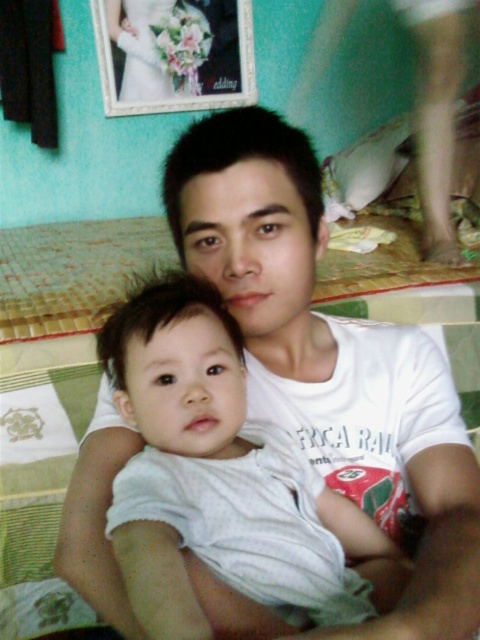
Question: Which point is farther to the camera?

Choices:
 (A) (193, 486)
 (B) (444, 128)

Answer: (B)

Question: Does white cotton baby at center have a greater width compared to smooth skin leg at lower right?

Choices:
 (A) no
 (B) yes

Answer: (B)

Question: Is white cotton baby at center below smooth skin leg at lower right?

Choices:
 (A) yes
 (B) no

Answer: (A)

Question: Is white cotton baby at center to the left of smooth skin leg at lower right from the viewer's perspective?

Choices:
 (A) yes
 (B) no

Answer: (A)

Question: Which of the following is the farthest from the observer?

Choices:
 (A) smooth skin leg at lower right
 (B) white cotton baby at center

Answer: (A)